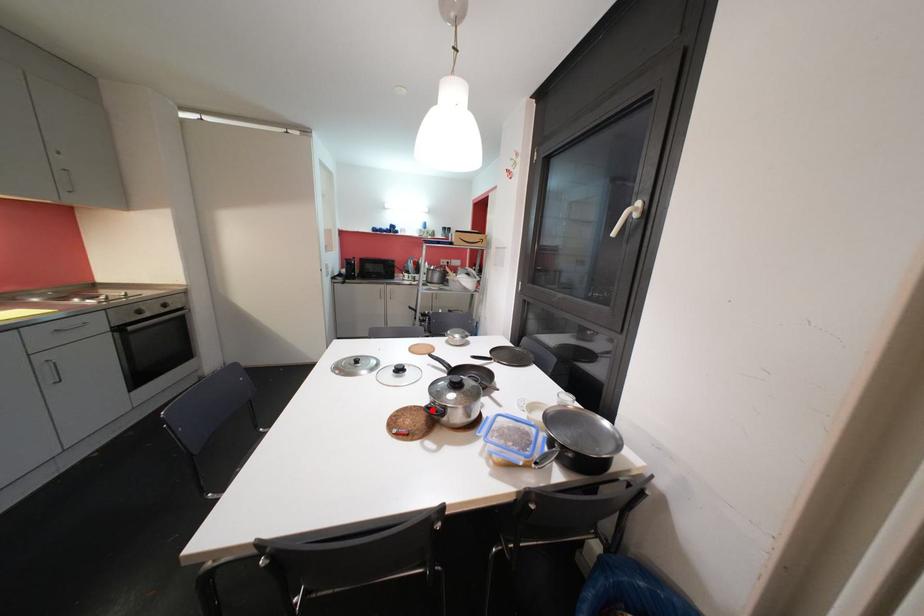
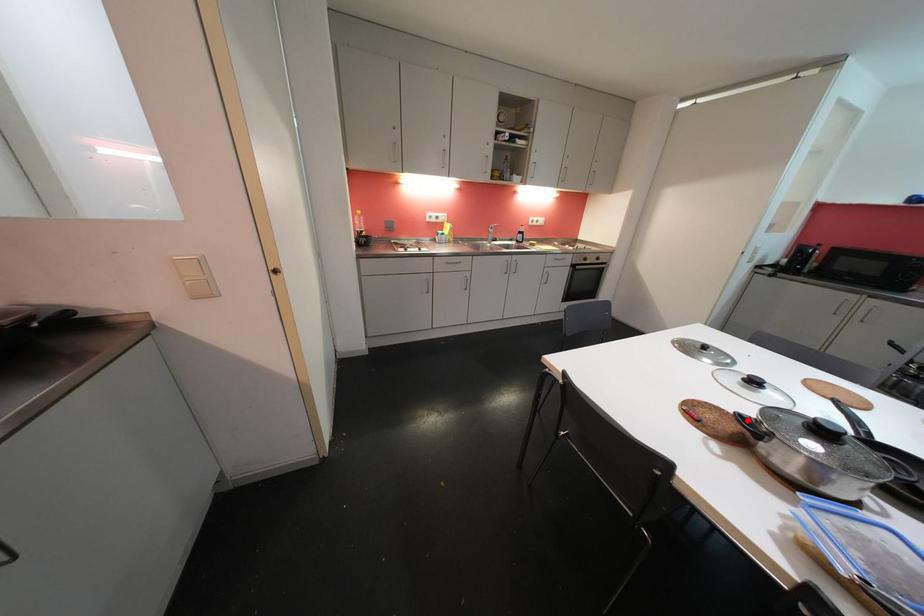
I am providing you with two images of the same scene from different viewpoints. A red point is marked on the first image and another point is marked on the second image. Is the red point in image1 aligned with the point shown in image2?

Yes